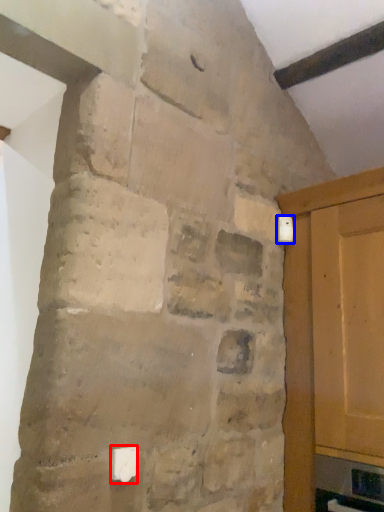
Question: Which of the following is the farthest to the observer, light switch (highlighted by a red box) or light switch (highlighted by a blue box)?

Choices:
 (A) light switch
 (B) light switch

Answer: (B)